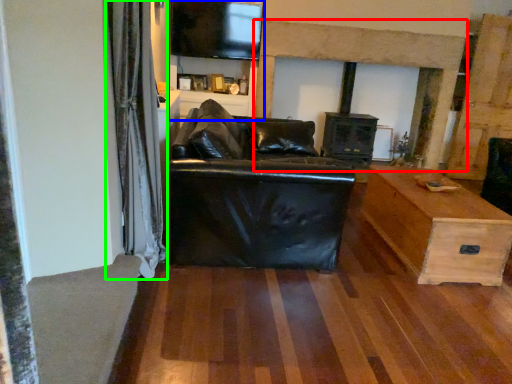
Question: Which is farther away from fireplace (highlighted by a red box)? entertainment center (highlighted by a blue box) or curtain (highlighted by a green box)?

Choices:
 (A) entertainment center
 (B) curtain

Answer: (B)